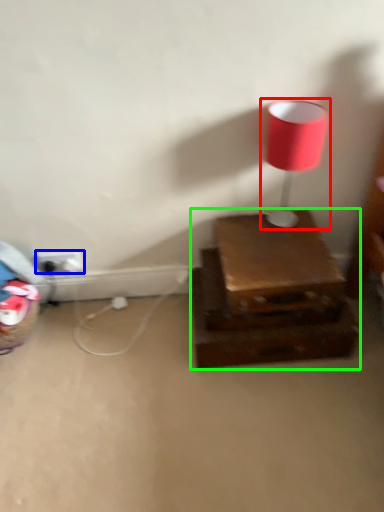
Question: Considering the real-world distances, which object is closest to lamp (highlighted by a red box)? electric outlet (highlighted by a blue box) or furniture (highlighted by a green box).

Choices:
 (A) electric outlet
 (B) furniture

Answer: (B)